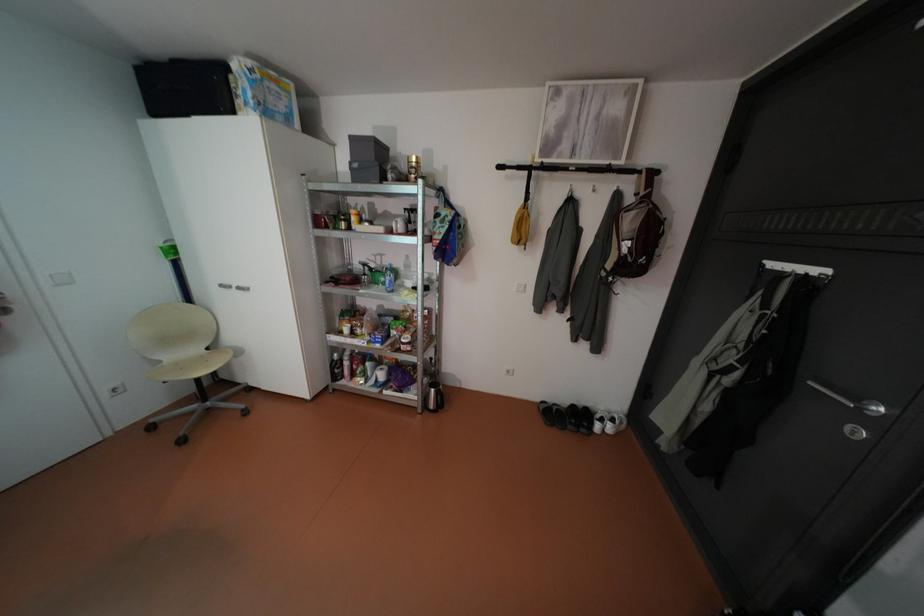
Find where to hang the white door hook. Please return your answer as a coordinate pair (x, y).

(795, 270)